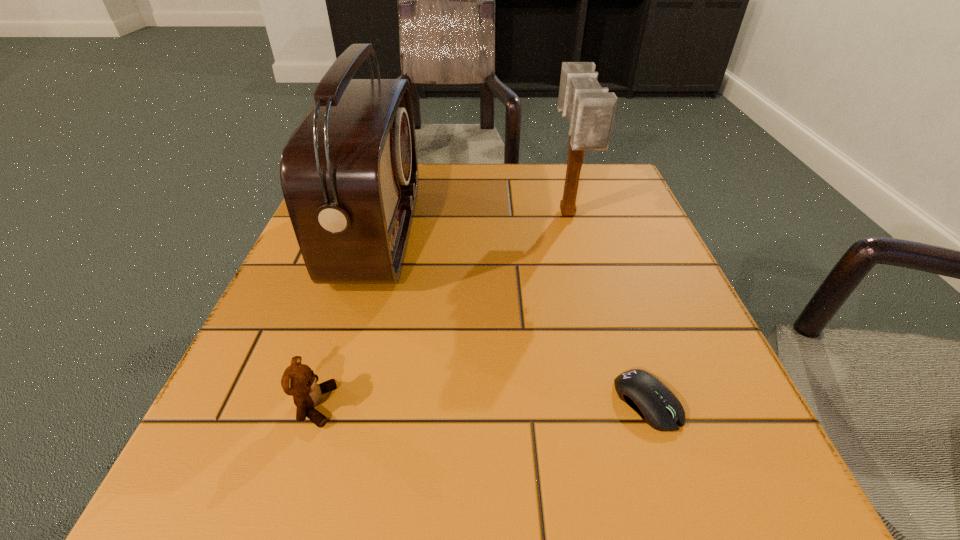
The width and height of the screenshot is (960, 540). I want to click on empty space that is in between the radio receiver and the computer equipment, so click(x=513, y=318).

This screenshot has width=960, height=540. Find the location of `free space between the teddy bear and the computer equipment`. free space between the teddy bear and the computer equipment is located at coordinates (481, 404).

In order to click on the second closest object relative to the mallet in this screenshot , I will do `click(657, 406)`.

Identify the location of object that stands as the second closest to the third tallest object. (657, 406).

This screenshot has width=960, height=540. What are the coordinates of `free location that satisfies the following two spatial constraints: 1. on the front side of the mallet; 2. on the front panel of the tallest object` in the screenshot? It's located at (572, 233).

Locate an element on the screen. vacant space that satisfies the following two spatial constraints: 1. on the front side of the mallet; 2. on the front-facing side of the second shortest object is located at coordinates (619, 406).

The width and height of the screenshot is (960, 540). Identify the location of vacant region that satisfies the following two spatial constraints: 1. on the front side of the shortest object; 2. on the right side of the third shortest object. (618, 402).

I want to click on vacant area that satisfies the following two spatial constraints: 1. on the front side of the mallet; 2. on the front panel of the tallest object, so click(572, 233).